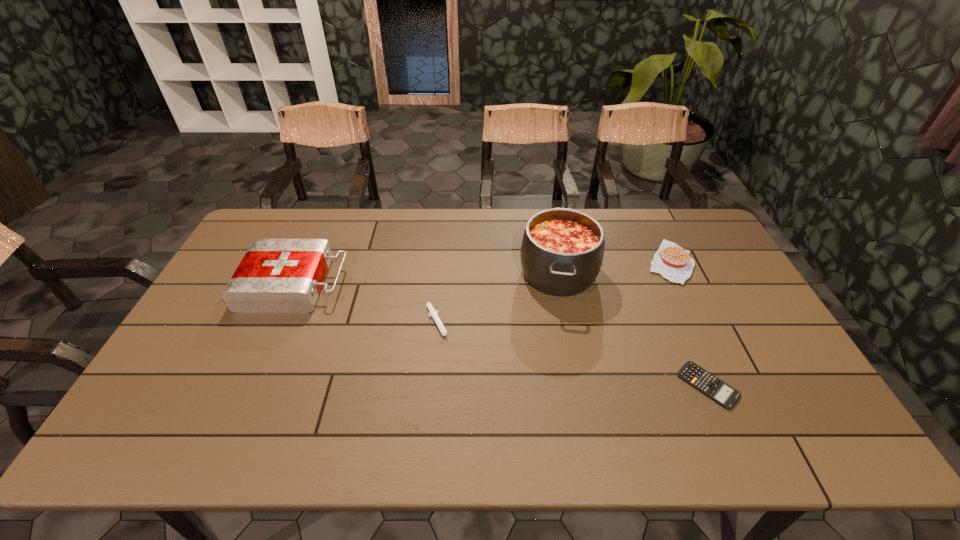
Identify the location of free location located 0.390m on the front side of the leftmost object. The height and width of the screenshot is (540, 960). (469, 284).

Where is `vacant space positioned on the left of the pie`? This screenshot has width=960, height=540. vacant space positioned on the left of the pie is located at coordinates (624, 262).

Where is `free region located 0.160m on the front of the syringe`? free region located 0.160m on the front of the syringe is located at coordinates (432, 400).

Locate an element on the screen. vacant area located 0.250m on the left of the shortest object is located at coordinates (582, 385).

Identify the location of casserole that is at the far edge. This screenshot has width=960, height=540. (562, 249).

This screenshot has width=960, height=540. I want to click on pie at the far edge, so click(x=675, y=264).

I want to click on object located in the left edge section of the desktop, so pos(276,275).

Image resolution: width=960 pixels, height=540 pixels. I want to click on object at the right edge, so click(675, 264).

At what (x,y) coordinates should I click in order to perform the action: click on object that is at the far right corner. Please return your answer as a coordinate pair (x, y). This screenshot has width=960, height=540. Looking at the image, I should click on (675, 264).

In the image, there is a desktop. What are the coordinates of `free space at the far edge` in the screenshot? It's located at (364, 237).